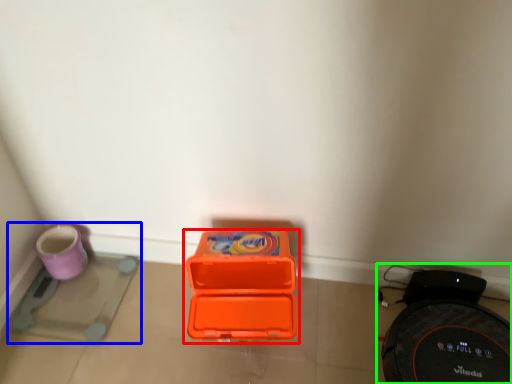
Question: Considering the real-world distances, which object is farthest from box (highlighted by a red box)? appliance (highlighted by a blue box) or appliance (highlighted by a green box)?

Choices:
 (A) appliance
 (B) appliance

Answer: (A)